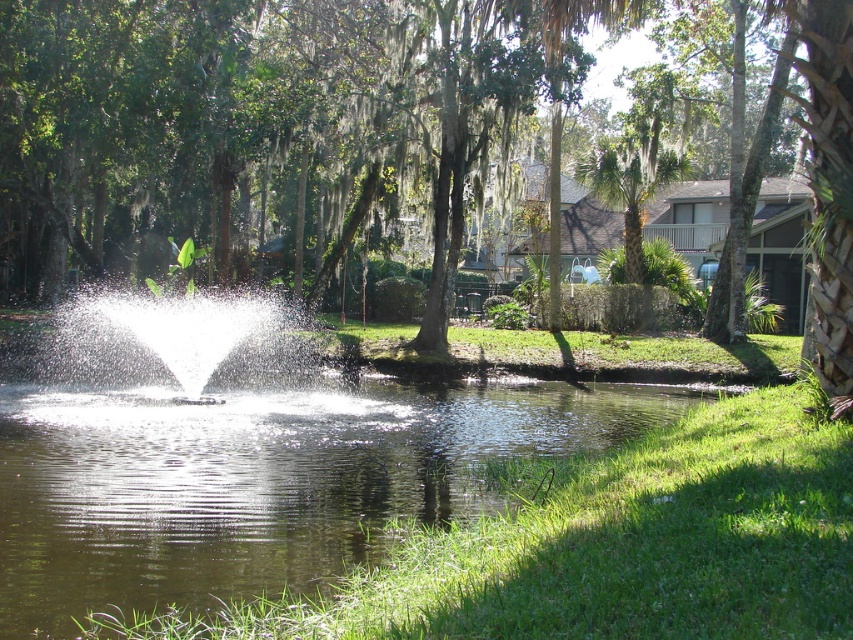
Between green mossy tree at center and green leafy palm tree at upper right, which one appears on the right side from the viewer's perspective?

green leafy palm tree at upper right is more to the right.

Who is shorter, green mossy tree at center or green leafy palm tree at upper right?

With less height is green leafy palm tree at upper right.

Does point (467, 81) come behind point (635, 230)?

That is False.

Identify the location of green mossy tree at center. Image resolution: width=853 pixels, height=640 pixels. (268, 122).

Can you confirm if clear water at center is thinner than green leafy palm tree at upper right?

Incorrect, clear water at center's width is not less than green leafy palm tree at upper right's.

Is clear water at center shorter than green leafy palm tree at upper right?

Indeed, clear water at center has a lesser height compared to green leafy palm tree at upper right.

Find the location of a particular element. clear water at center is located at coordinates (259, 481).

Find the location of a particular element. clear water at center is located at coordinates (259, 481).

Between clear water at center and white water at center, which one is positioned lower?

clear water at center is below.

Consider the image. Between clear water at center and white water at center, which one has less height?

With less height is clear water at center.

Who is more distant from viewer, (62, 433) or (212, 346)?

Point (212, 346)

The image size is (853, 640). I want to click on clear water at center, so click(259, 481).